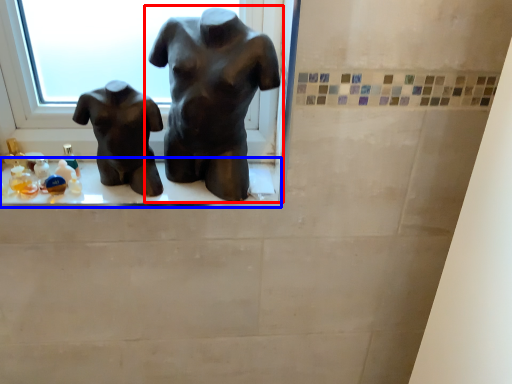
Question: Which object appears closest to the camera in this image, statue (sculpture) (highlighted by a red box) or window sill (highlighted by a blue box)?

Choices:
 (A) statue (sculpture)
 (B) window sill

Answer: (A)